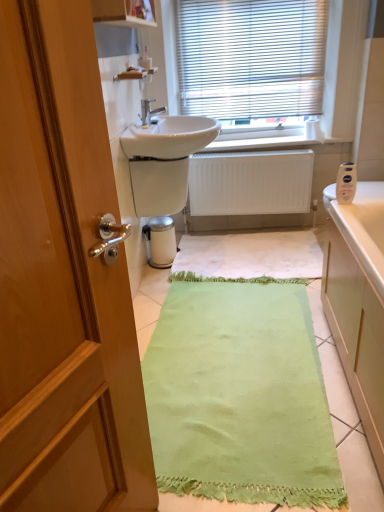
Question: Would you say matte silver faucet at center is inside or outside white matte radiator at center?

Choices:
 (A) outside
 (B) inside

Answer: (A)

Question: Considering the positions of matte silver faucet at center and white matte radiator at center in the image, is matte silver faucet at center taller or shorter than white matte radiator at center?

Choices:
 (A) short
 (B) tall

Answer: (A)

Question: Considering the real-world distances, which object is farthest from the white matte radiator at center?

Choices:
 (A) matte silver faucet at center
 (B) white glossy sink at center
 (C) green fabric bath mat at center
 (D) white matte toilet paper at upper right
 (E) white plastic blinds at upper center

Answer: (C)

Question: Which object is positioned closest to the white plastic lotion at upper right?

Choices:
 (A) white plastic blinds at upper center
 (B) green fabric bath mat at center
 (C) white glossy sink at center
 (D) matte silver faucet at center
 (E) white matte radiator at center

Answer: (E)